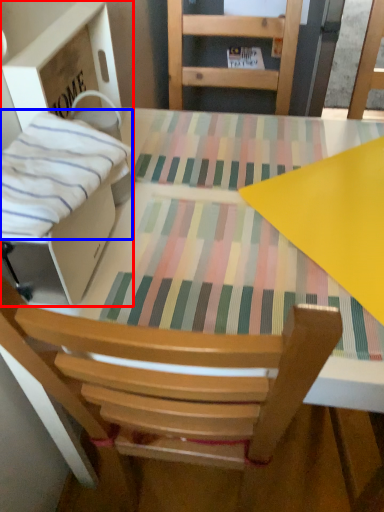
Question: Among these objects, which one is nearest to the camera, cardboard box (highlighted by a red box) or blanket (highlighted by a blue box)?

Choices:
 (A) cardboard box
 (B) blanket

Answer: (B)